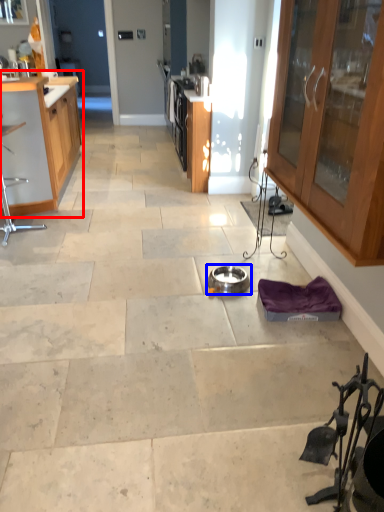
Question: Which of the following is the farthest to the observer, cabinetry (highlighted by a red box) or appliance (highlighted by a blue box)?

Choices:
 (A) cabinetry
 (B) appliance

Answer: (A)